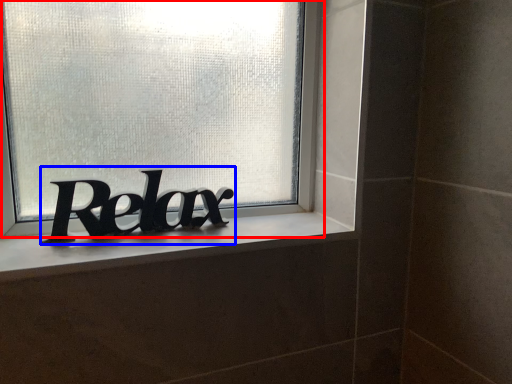
Question: Among these objects, which one is farthest to the camera, window (highlighted by a red box) or lettering (highlighted by a blue box)?

Choices:
 (A) window
 (B) lettering

Answer: (B)